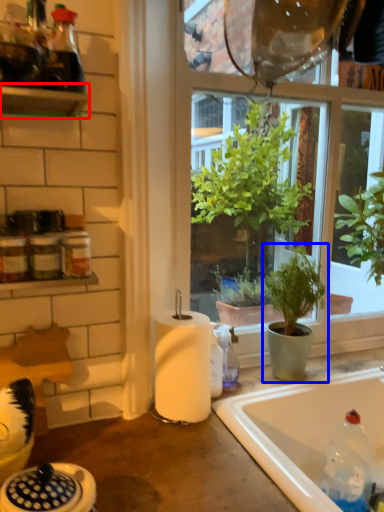
Question: Which of the following is the closest to the observer, shelf (highlighted by a red box) or houseplant (highlighted by a blue box)?

Choices:
 (A) shelf
 (B) houseplant

Answer: (A)